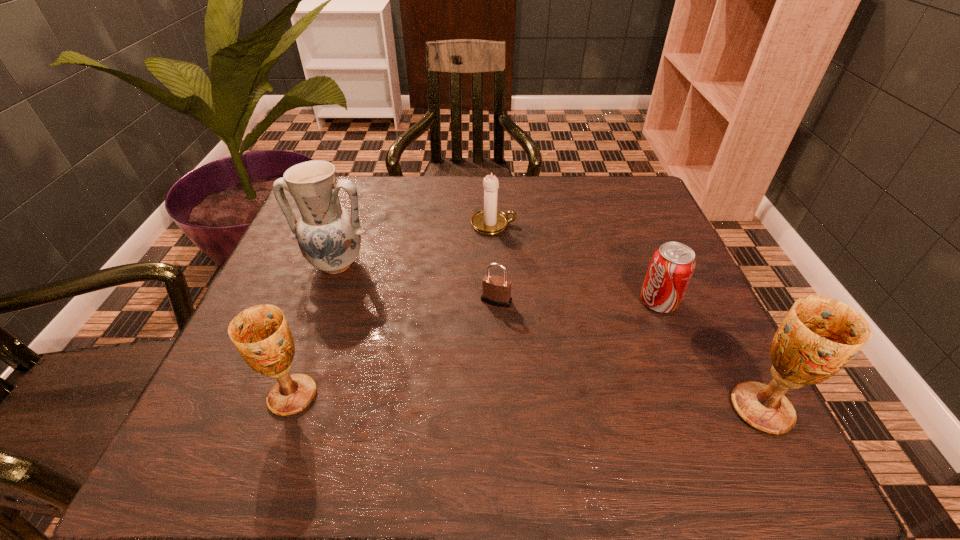
You are a GUI agent. You are given a task and a screenshot of the screen. Output one action in this format:
    pyautogui.click(x=<x>, y=<y>)
    Task: Click on the vacant space situated on the handle side of the candle holder
    The height and width of the screenshot is (540, 960).
    Given the screenshot: What is the action you would take?
    pyautogui.click(x=594, y=224)

The image size is (960, 540). What are the coordinates of `vacant area located on either side of the fifth nearest object` in the screenshot? It's located at (286, 401).

Image resolution: width=960 pixels, height=540 pixels. What are the coordinates of `vacant space positioned 0.050m on the front of the soda` in the screenshot? It's located at (672, 335).

At what (x,y) coordinates should I click in order to perform the action: click on blank area located on the left of the shortest object. Please return your answer as a coordinate pair (x, y). Image resolution: width=960 pixels, height=540 pixels. Looking at the image, I should click on (452, 301).

Identify the location of object that is at the far edge. (488, 221).

What are the coordinates of `chalice that is at the left edge` in the screenshot? It's located at (261, 335).

Where is `pottery that is at the left edge`? This screenshot has width=960, height=540. pottery that is at the left edge is located at coordinates (329, 237).

This screenshot has width=960, height=540. Identify the location of chalice that is at the right edge. (819, 335).

Identify the location of soda present at the right edge. This screenshot has height=540, width=960. (671, 268).

The image size is (960, 540). I want to click on object present at the near left corner, so click(x=261, y=335).